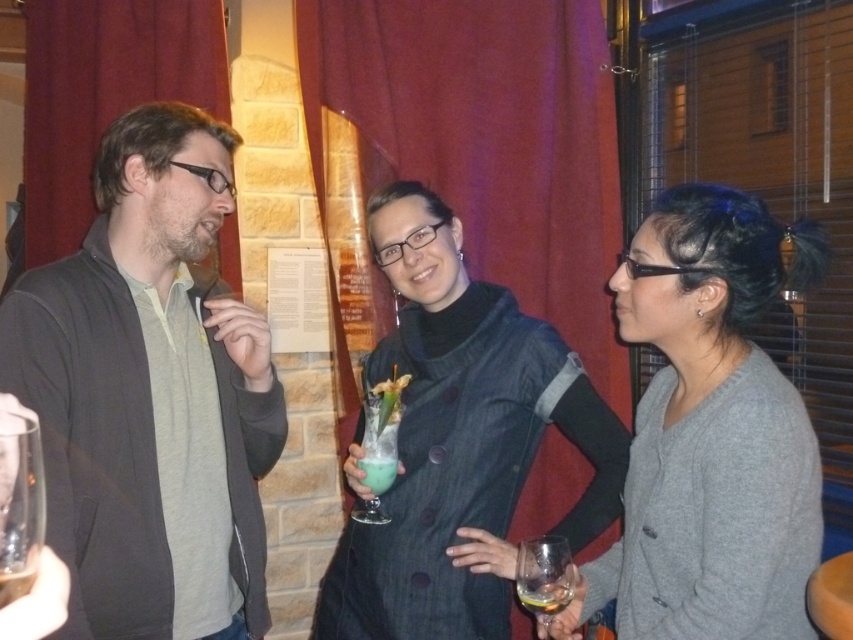
Question: Is translucent glass drink at center to the right of green frosted glass at center from the viewer's perspective?

Choices:
 (A) no
 (B) yes

Answer: (A)

Question: Which of the following is the closest to the observer?

Choices:
 (A) (416, 285)
 (B) (532, 573)

Answer: (B)

Question: Is denim jacket at center below clear glass at lower left?

Choices:
 (A) yes
 (B) no

Answer: (A)

Question: Does transparent glass at lower left lie in front of green frosted glass at center?

Choices:
 (A) yes
 (B) no

Answer: (A)

Question: Which object is closer to the camera taking this photo?

Choices:
 (A) gray woolen sweater at center
 (B) translucent glass at lower right
 (C) transparent glass at lower center
 (D) transparent glass at lower left

Answer: (D)

Question: Which object is positioned farthest from the transparent glass at lower center?

Choices:
 (A) green frosted glass at center
 (B) transparent glass at lower left

Answer: (B)